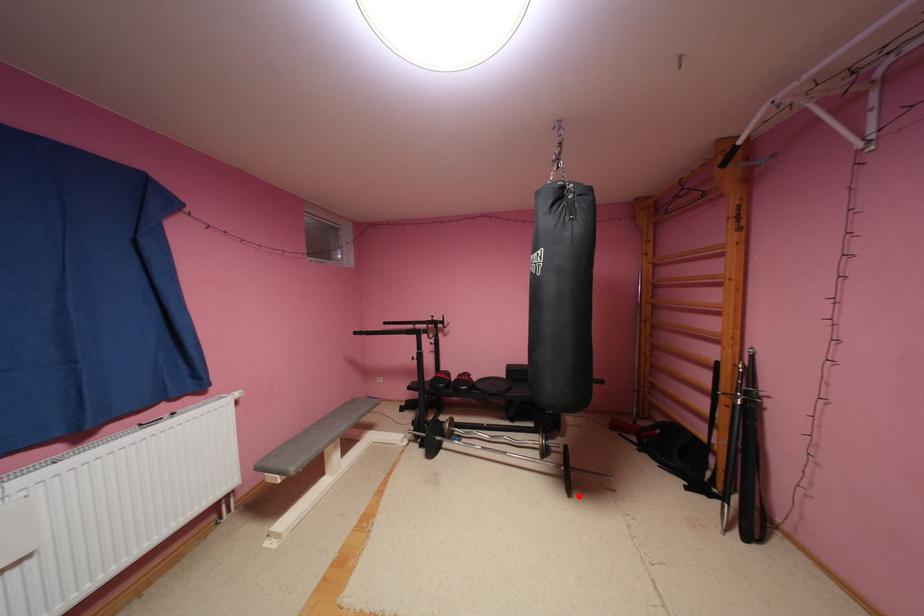
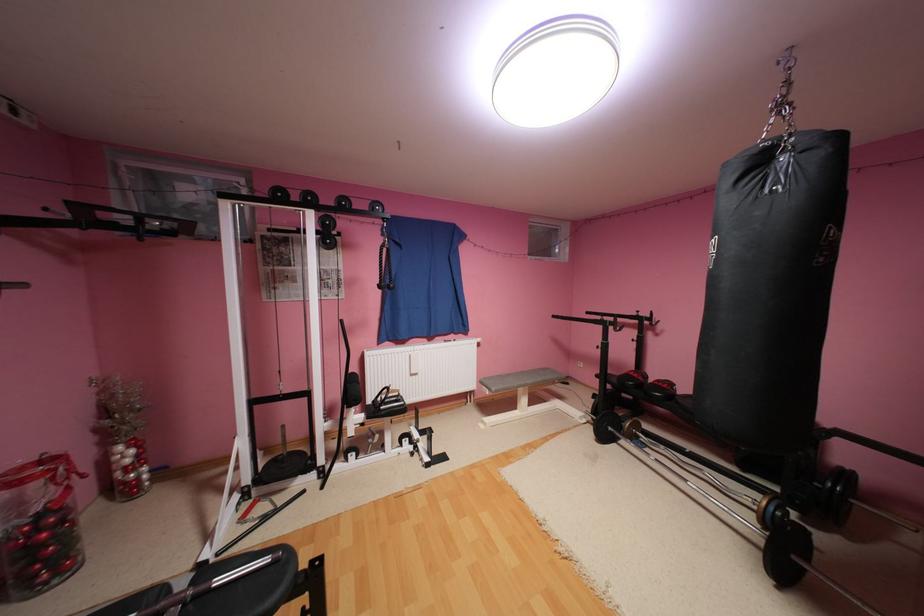
Question: I am providing you with two images of the same scene from different viewpoints. A red point is shown in image1. For the corresponding object point in image2, is it positioned nearer or farther from the camera?

Choices:
 (A) Nearer
 (B) Farther

Answer: (A)